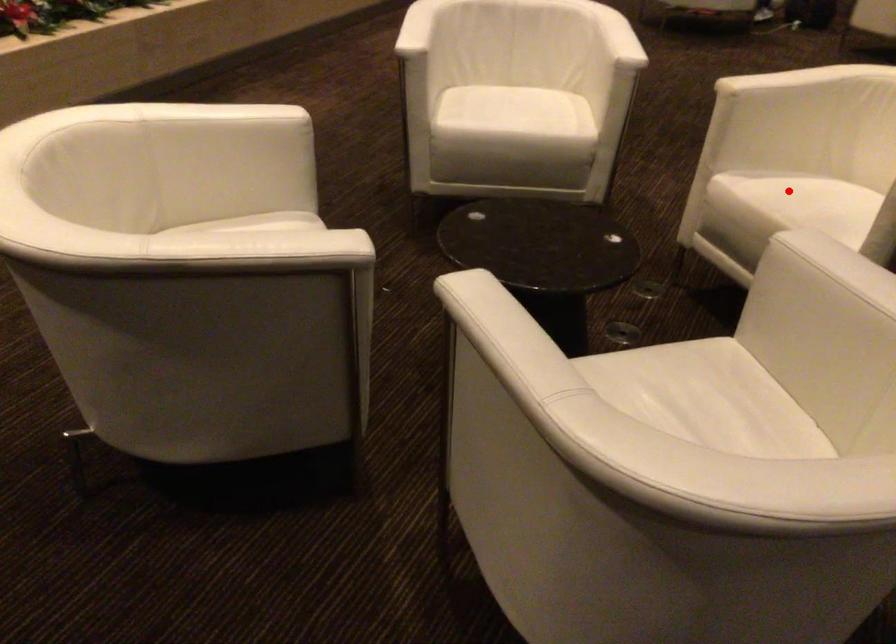
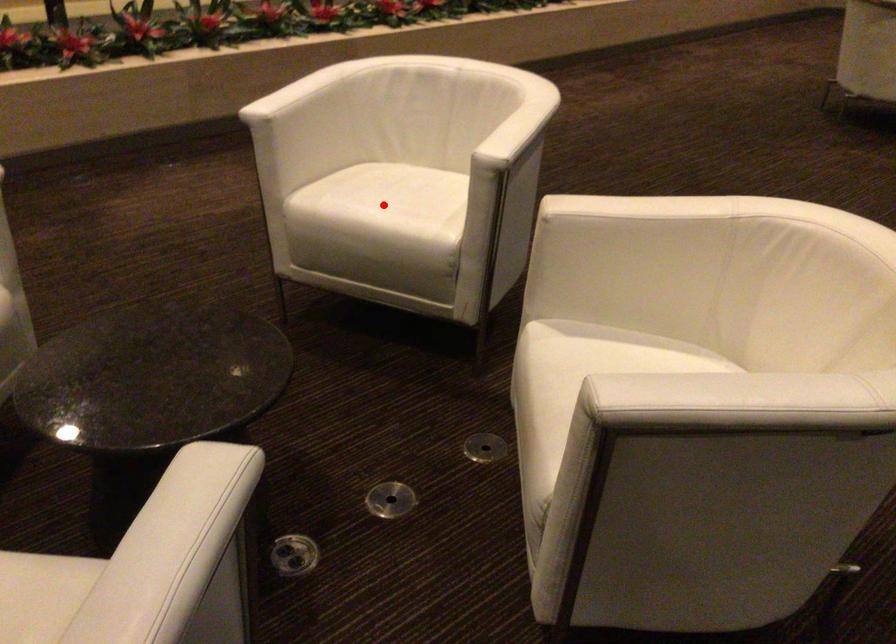
In the scene shown: I am providing you with two images of the same scene from different viewpoints. A red point is marked on the first image and another point is marked on the second image. Is the marked point in image1 the same physical position as the marked point in image2?

No